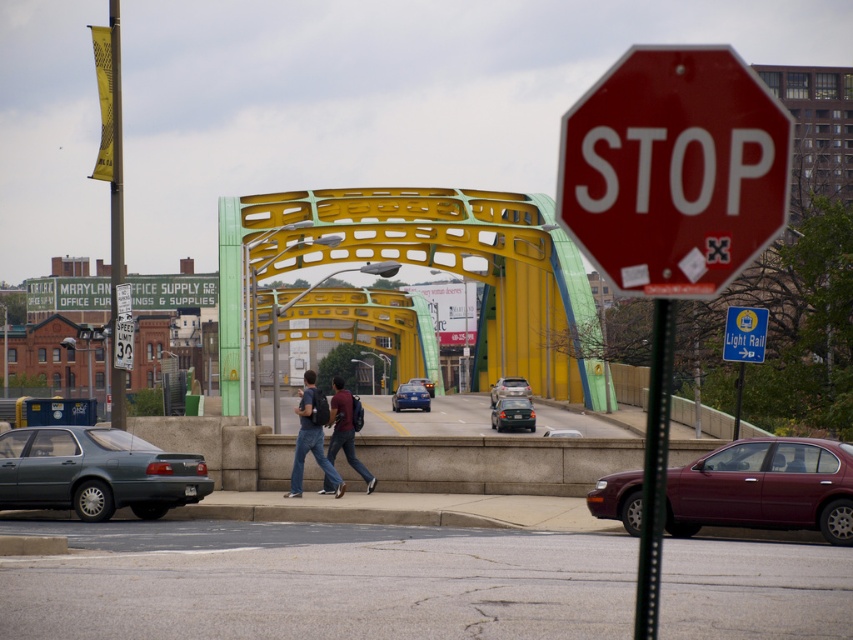
Between yellow fabric banner at left and matte black sedan at center, which one is positioned lower?

Positioned lower is matte black sedan at center.

Is yellow fabric banner at left above matte black sedan at center?

Correct, yellow fabric banner at left is located above matte black sedan at center.

Describe the element at coordinates (115, 161) in the screenshot. I see `yellow fabric banner at left` at that location.

Where is `yellow fabric banner at left`? This screenshot has height=640, width=853. yellow fabric banner at left is located at coordinates (115, 161).

Can you confirm if matte gray sedan at lower left is smaller than blue plastic sign at upper center?

Incorrect, matte gray sedan at lower left is not smaller in size than blue plastic sign at upper center.

Can you confirm if matte gray sedan at lower left is bigger than blue plastic sign at upper center?

Indeed, matte gray sedan at lower left has a larger size compared to blue plastic sign at upper center.

Who is more distant from viewer, [67,483] or [750,349]?

The point [750,349] is more distant.

The width and height of the screenshot is (853, 640). What are the coordinates of `matte gray sedan at lower left` in the screenshot? It's located at (96, 472).

Does matte black sedan at center appear over metallic silver suv at center?

Incorrect, matte black sedan at center is not positioned above metallic silver suv at center.

Is matte black sedan at center thinner than metallic silver suv at center?

Correct, matte black sedan at center's width is less than metallic silver suv at center's.

Find the location of a particular element. The width and height of the screenshot is (853, 640). matte black sedan at center is located at coordinates (512, 413).